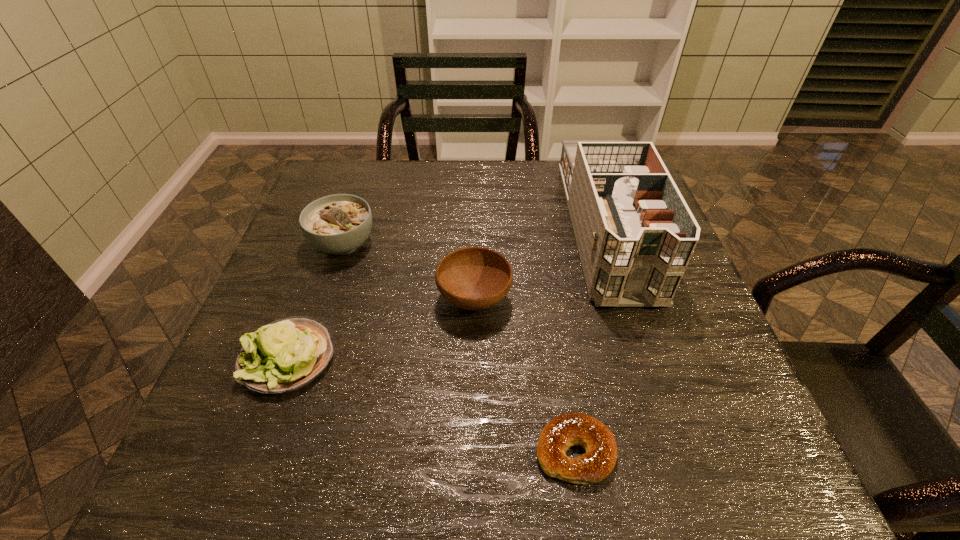
I want to click on the tallest object, so click(635, 234).

Image resolution: width=960 pixels, height=540 pixels. Find the location of `dollhouse`. dollhouse is located at coordinates (635, 234).

This screenshot has height=540, width=960. I want to click on soup bowl, so click(x=338, y=224).

Where is `bowl`? bowl is located at coordinates (473, 278).

Image resolution: width=960 pixels, height=540 pixels. Find the location of `the second shortest object`. the second shortest object is located at coordinates pyautogui.click(x=285, y=355).

This screenshot has width=960, height=540. Find the location of `the nearest object`. the nearest object is located at coordinates (570, 429).

I want to click on the fourth object from left to right, so click(x=570, y=429).

The image size is (960, 540). I want to click on free space located 0.230m at the entrance of the tallest object, so click(663, 411).

The width and height of the screenshot is (960, 540). I want to click on vacant region located on the front of the soup bowl, so click(316, 326).

Where is `vacant space situated on the left of the bowl`? The width and height of the screenshot is (960, 540). vacant space situated on the left of the bowl is located at coordinates (401, 300).